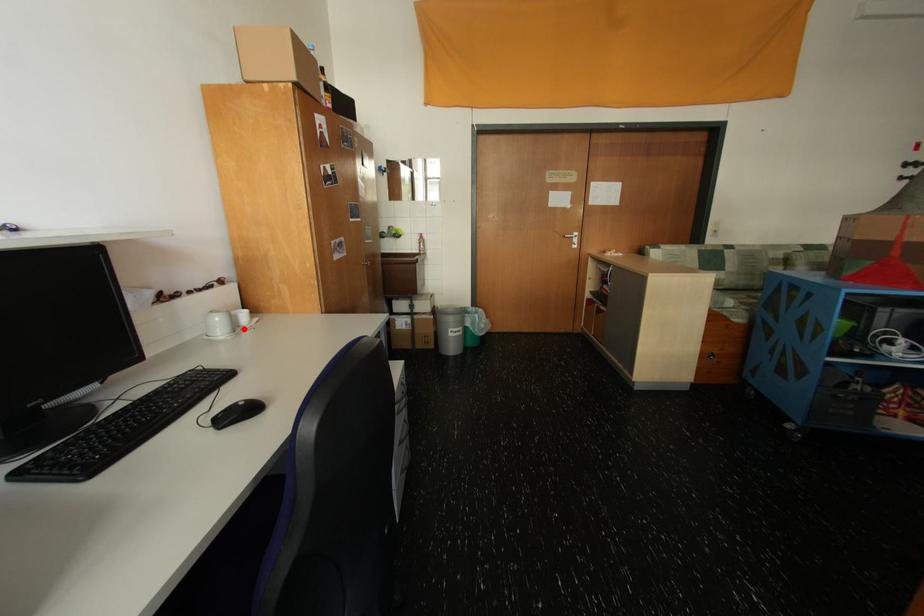
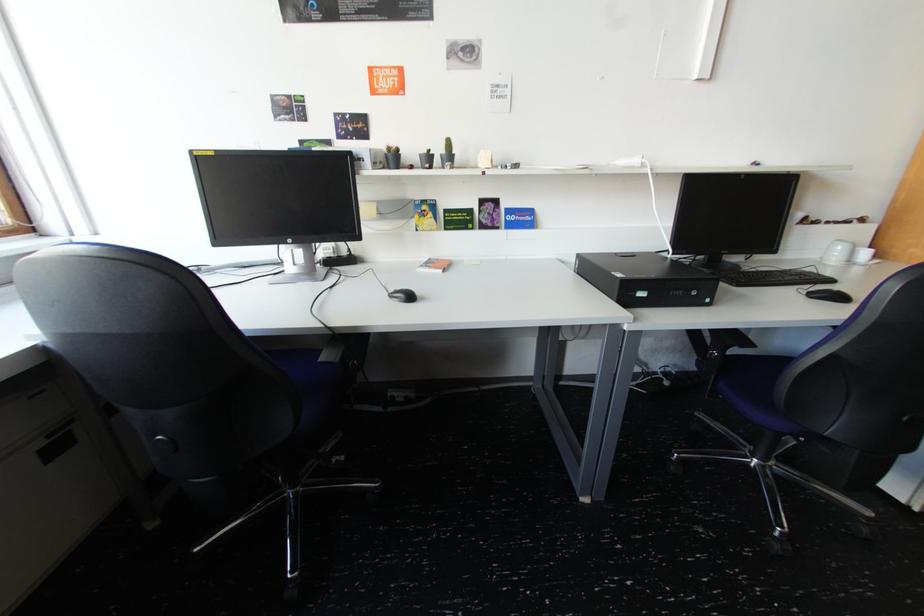
Where in the second image is the point corresponding to the highlighted location from the first image?

(859, 262)